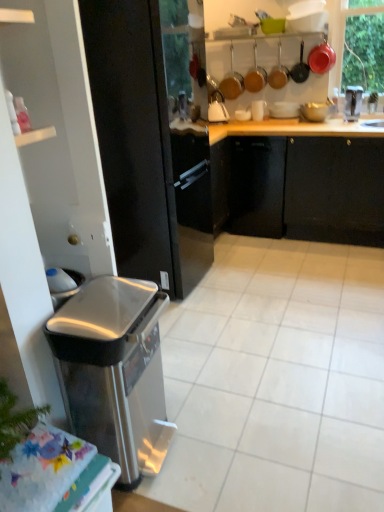
The image size is (384, 512). What do you see at coordinates (35, 136) in the screenshot? I see `white glossy shelf at upper left` at bounding box center [35, 136].

Where is `matte brown pot at upper center, acting as the sixth appliance starting from the right`? The width and height of the screenshot is (384, 512). matte brown pot at upper center, acting as the sixth appliance starting from the right is located at coordinates (278, 73).

Describe the element at coordinates (284, 110) in the screenshot. I see `white glossy bowl at upper center, which is the fifth appliance from right to left` at that location.

The height and width of the screenshot is (512, 384). What do you see at coordinates (353, 103) in the screenshot? I see `white glossy sink at upper right` at bounding box center [353, 103].

Image resolution: width=384 pixels, height=512 pixels. I want to click on metallic black frying pan at upper right, arranged as the fourth appliance when viewed from the left, so click(x=300, y=68).

Looking at this image, is matte brown pot at upper center, positioned as the 2th appliance in left-to-right order, aimed at satin nickel kettle at upper center?

No, matte brown pot at upper center, positioned as the 2th appliance in left-to-right order, is not aimed at satin nickel kettle at upper center.

Is matte brown pot at upper center, positioned as the 2th appliance in left-to-right order, taller than satin nickel kettle at upper center?

Yes, matte brown pot at upper center, positioned as the 2th appliance in left-to-right order, is taller than satin nickel kettle at upper center.

From the image's perspective, which is below, matte brown pot at upper center, positioned as the 2th appliance in left-to-right order, or satin nickel kettle at upper center?

satin nickel kettle at upper center is shown below in the image.

How distant is stainless steel trash can at lower left from metallic black frying pan at upper right, which is the fourth appliance from right to left?

The distance of stainless steel trash can at lower left from metallic black frying pan at upper right, which is the fourth appliance from right to left, is 2.98 meters.

Considering the positions of objects stainless steel trash can at lower left and metallic black frying pan at upper right, arranged as the fourth appliance when viewed from the left, in the image provided, who is more to the right, stainless steel trash can at lower left or metallic black frying pan at upper right, arranged as the fourth appliance when viewed from the left,?

From the viewer's perspective, metallic black frying pan at upper right, arranged as the fourth appliance when viewed from the left, appears more on the right side.

Which is behind, stainless steel trash can at lower left or metallic black frying pan at upper right, arranged as the fourth appliance when viewed from the left?

Positioned behind is metallic black frying pan at upper right, arranged as the fourth appliance when viewed from the left.

Which object is thinner, stainless steel trash can at lower left or metallic black frying pan at upper right, arranged as the fourth appliance when viewed from the left?

Thinner between the two is metallic black frying pan at upper right, arranged as the fourth appliance when viewed from the left.

Looking at this image, is satin nickel kettle at upper center wider than metallic black frying pan at upper right, which is the fourth appliance from right to left?

Yes.

Would you say satin nickel kettle at upper center is to the left or to the right of metallic black frying pan at upper right, arranged as the fourth appliance when viewed from the left, in the picture?

In the image, satin nickel kettle at upper center appears on the left side of metallic black frying pan at upper right, arranged as the fourth appliance when viewed from the left.

How much distance is there between satin nickel kettle at upper center and metallic black frying pan at upper right, which is the fourth appliance from right to left?

26.81 inches.

Is satin nickel kettle at upper center in front of or behind metallic black frying pan at upper right, arranged as the fourth appliance when viewed from the left, in the image?

Visually, satin nickel kettle at upper center is located behind metallic black frying pan at upper right, arranged as the fourth appliance when viewed from the left.

From the image's perspective, between white glossy sink at upper right and metallic stainless steel faucet at upper right, marked as the 1th appliance in a right-to-left arrangement, who is located below?

From the image's view, white glossy sink at upper right is below.

Which of these two, white glossy sink at upper right or metallic stainless steel faucet at upper right, marked as the 1th appliance in a right-to-left arrangement, is wider?

With larger width is white glossy sink at upper right.

Is white glossy sink at upper right in front of or behind metallic stainless steel faucet at upper right, which ranks as the 7th appliance in left-to-right order, in the image?

white glossy sink at upper right is in front of metallic stainless steel faucet at upper right, which ranks as the 7th appliance in left-to-right order.

Is printed fabric table at lower left touching satin nickel kettle at upper center?

No, printed fabric table at lower left is not next to satin nickel kettle at upper center.

Does printed fabric table at lower left have a smaller size compared to satin nickel kettle at upper center?

Actually, printed fabric table at lower left might be larger than satin nickel kettle at upper center.

Which is less distant, (21, 496) or (211, 95)?

Point (21, 496) is closer to the camera than point (211, 95).

From a real-world perspective, starting from the matte brown pot at upper center, acting as the sixth appliance starting from the right, which appliance is the 2nd one below it? Please provide its 2D coordinates.

[(353, 103)]

Relative to metallic stainless steel faucet at upper right, which ranks as the 7th appliance in left-to-right order, is matte brown pot at upper center, positioned as the 2th appliance in left-to-right order, in front or behind?

In the image, matte brown pot at upper center, positioned as the 2th appliance in left-to-right order, appears behind metallic stainless steel faucet at upper right, which ranks as the 7th appliance in left-to-right order.

Does matte brown pot at upper center, acting as the sixth appliance starting from the right, have a larger size compared to metallic stainless steel faucet at upper right, which ranks as the 7th appliance in left-to-right order?

Yes, matte brown pot at upper center, acting as the sixth appliance starting from the right, is bigger than metallic stainless steel faucet at upper right, which ranks as the 7th appliance in left-to-right order.

Is matte brown pot at upper center, positioned as the 2th appliance in left-to-right order, at the left side of metallic stainless steel faucet at upper right, marked as the 1th appliance in a right-to-left arrangement?

Yes, matte brown pot at upper center, positioned as the 2th appliance in left-to-right order, is to the left of metallic stainless steel faucet at upper right, marked as the 1th appliance in a right-to-left arrangement.

Which of these two, black glossy refrigerator at left or matte brown pot at upper center, acting as the sixth appliance starting from the right, stands shorter?

matte brown pot at upper center, acting as the sixth appliance starting from the right.

Is point (145, 90) positioned behind point (280, 57)?

No, it is not.

Considering the sizes of black glossy refrigerator at left and matte brown pot at upper center, acting as the sixth appliance starting from the right, in the image, is black glossy refrigerator at left bigger or smaller than matte brown pot at upper center, acting as the sixth appliance starting from the right,?

Clearly, black glossy refrigerator at left is larger in size than matte brown pot at upper center, acting as the sixth appliance starting from the right.

Which object is further away from the camera taking this photo, black glossy refrigerator at left or matte brown pot at upper center, positioned as the 2th appliance in left-to-right order?

matte brown pot at upper center, positioned as the 2th appliance in left-to-right order, is more distant.

Locate an element on the screen. The height and width of the screenshot is (512, 384). kitchen appliance behind the matte brown pot at upper center, acting as the sixth appliance starting from the right is located at coordinates (217, 106).

There is a stainless steel trash can at lower left. Identify the location of the 6th appliance above it (from the image's perspective). (300, 68).

From the picture: Based on their spatial positions, is white glossy shelf at upper left or metallic black frying pan at upper right, which is the fourth appliance from right to left, closer to white glossy sink at upper right?

Among the two, metallic black frying pan at upper right, which is the fourth appliance from right to left, is located nearer to white glossy sink at upper right.

When comparing their distances from black glossy refrigerator at left, does matte red pot at upper right, the sixth appliance positioned from the left, or printed fabric table at lower left seem closer?

printed fabric table at lower left is closer to black glossy refrigerator at left.

Which object lies further to the anchor point matte red pot at upper right, marked as the second appliance in a right-to-left arrangement, printed fabric table at lower left or stainless steel trash can at lower left?

printed fabric table at lower left is positioned further to the anchor matte red pot at upper right, marked as the second appliance in a right-to-left arrangement.

When comparing their distances from matte brown pot at upper center, acting as the sixth appliance starting from the right, does metallic black frying pan at upper right, which is the fourth appliance from right to left, or stainless steel trash can at lower left seem further?

stainless steel trash can at lower left lies further to matte brown pot at upper center, acting as the sixth appliance starting from the right, than the other object.

Consider the image. Estimate the real-world distances between objects in this image. Which object is closer to matte white bowl at upper center, which appears as the 3th appliance when viewed from the right, printed fabric table at lower left or white glossy sink at upper right?

white glossy sink at upper right is positioned closer to the anchor matte white bowl at upper center, which appears as the 3th appliance when viewed from the right.

Which object lies further to the anchor point matte red pot at upper right, the sixth appliance positioned from the left, white glossy shelf at upper left or stainless steel trash can at lower left?

stainless steel trash can at lower left is further to matte red pot at upper right, the sixth appliance positioned from the left.

From the image, which object appears to be farther from satin nickel kettle at upper center, printed fabric table at lower left or stainless steel trash can at lower left?

printed fabric table at lower left lies further to satin nickel kettle at upper center than the other object.

From the image, which object appears to be farther from white glossy bowl at upper center, which is the fifth appliance from right to left, matte white bowl at upper center, which is counted as the fifth appliance, starting from the left, or white glossy sink at upper right?

white glossy sink at upper right lies further to white glossy bowl at upper center, which is the fifth appliance from right to left, than the other object.

The image size is (384, 512). I want to click on screen door between matte red pot at upper right, marked as the second appliance in a right-to-left arrangement, and printed fabric table at lower left from top to bottom, so click(x=134, y=135).

What are the coordinates of `screen door between stainless steel trash can at lower left and matte brown pot at upper center, positioned as the 2th appliance in left-to-right order, from front to back` in the screenshot? It's located at (134, 135).

In order to click on appliance between satin nickel kettle at upper center and matte brown pot at upper center, acting as the sixth appliance starting from the right in this screenshot , I will do `click(232, 82)`.

Find the location of a particular element. The image size is (384, 512). home appliance between printed fabric table at lower left and metallic copper pot at upper center, arranged as the first appliance when viewed from the left, along the z-axis is located at coordinates (114, 371).